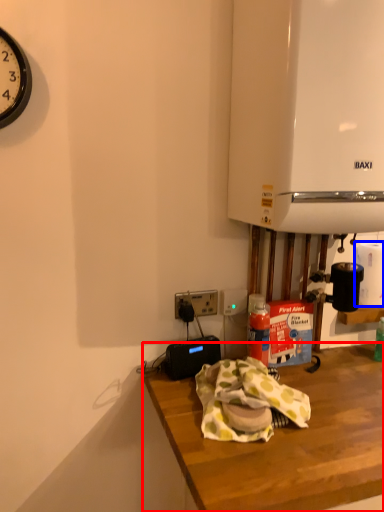
Question: Which of the following is the farthest to the observer, desk (highlighted by a red box) or paper towel (highlighted by a blue box)?

Choices:
 (A) desk
 (B) paper towel

Answer: (B)